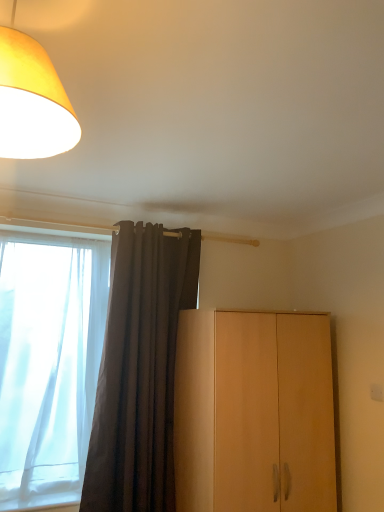
Question: Considering the relative sizes of light wood cabinet at right and yellow fabric lampshade at upper left in the image provided, is light wood cabinet at right smaller than yellow fabric lampshade at upper left?

Choices:
 (A) no
 (B) yes

Answer: (A)

Question: Can you confirm if light wood cabinet at right is thinner than yellow fabric lampshade at upper left?

Choices:
 (A) yes
 (B) no

Answer: (B)

Question: Is light wood cabinet at right closer to camera compared to yellow fabric lampshade at upper left?

Choices:
 (A) no
 (B) yes

Answer: (A)

Question: Is light wood cabinet at right not inside yellow fabric lampshade at upper left?

Choices:
 (A) yes
 (B) no

Answer: (A)

Question: From the image's perspective, is light wood cabinet at right located above yellow fabric lampshade at upper left?

Choices:
 (A) no
 (B) yes

Answer: (A)

Question: Is light wood cabinet at right facing away from yellow fabric lampshade at upper left?

Choices:
 (A) yes
 (B) no

Answer: (B)

Question: Considering the relative sizes of white sheer curtain at left and light wood cabinet at right in the image provided, is white sheer curtain at left bigger than light wood cabinet at right?

Choices:
 (A) no
 (B) yes

Answer: (A)

Question: Would you say white sheer curtain at left contains light wood cabinet at right?

Choices:
 (A) yes
 (B) no

Answer: (B)

Question: From the image's perspective, is white sheer curtain at left located beneath light wood cabinet at right?

Choices:
 (A) no
 (B) yes

Answer: (A)

Question: Is white sheer curtain at left shorter than light wood cabinet at right?

Choices:
 (A) yes
 (B) no

Answer: (B)

Question: From a real-world perspective, does white sheer curtain at left stand above light wood cabinet at right?

Choices:
 (A) no
 (B) yes

Answer: (B)

Question: Does white sheer curtain at left come in front of light wood cabinet at right?

Choices:
 (A) no
 (B) yes

Answer: (A)

Question: Is dark gray fabric curtain at center at the right side of white sheer curtain at left?

Choices:
 (A) no
 (B) yes

Answer: (B)